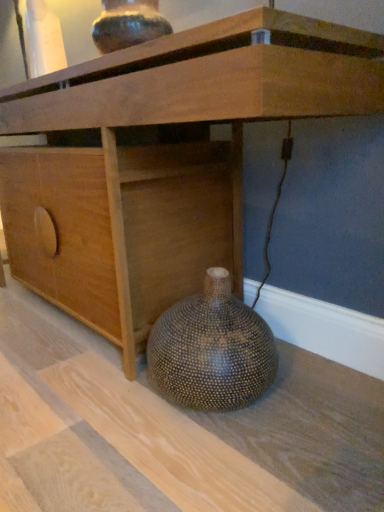
The height and width of the screenshot is (512, 384). I want to click on empty space that is to the right of brown textured vase at lower right, the 1th vase in the bottom-to-top sequence, so click(321, 399).